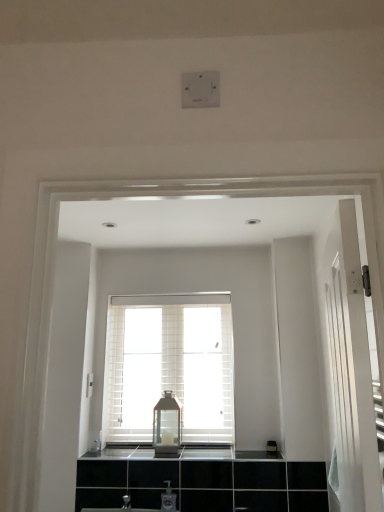
Question: Is matte glass lantern at center in front of or behind clear plastic soap dispenser at lower center in the image?

Choices:
 (A) behind
 (B) front

Answer: (A)

Question: In terms of size, does matte glass lantern at center appear bigger or smaller than clear plastic soap dispenser at lower center?

Choices:
 (A) big
 (B) small

Answer: (A)

Question: Which object is the farthest from the white textured window at center?

Choices:
 (A) matte glass lantern at center
 (B) black glossy countertop at center
 (C) clear plastic soap dispenser at lower center

Answer: (C)

Question: Considering the real-world distances, which object is farthest from the black glossy countertop at center?

Choices:
 (A) white textured window at center
 (B) matte glass lantern at center
 (C) clear plastic soap dispenser at lower center

Answer: (A)